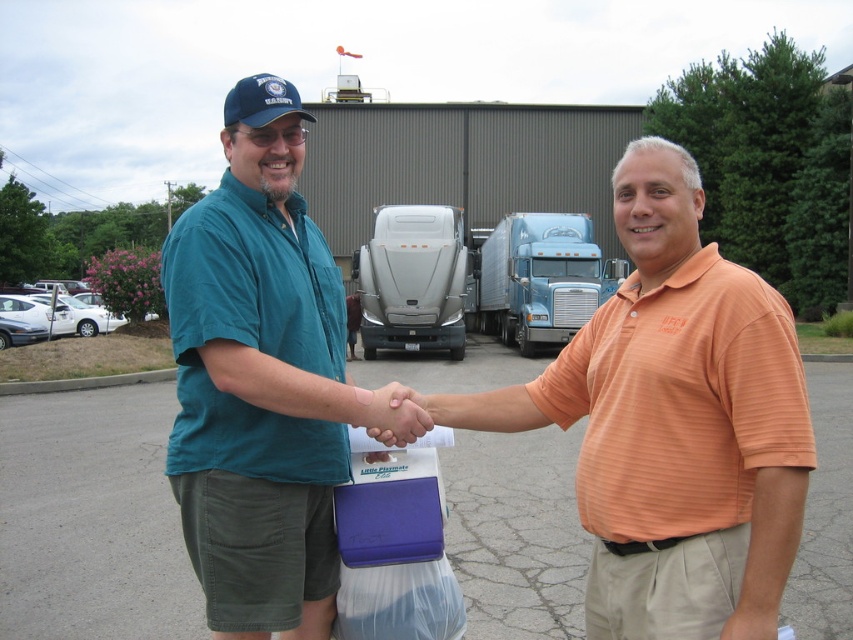
You are a photographer trying to capture a wide shot of the orange striped polo shirt at center and the blue metallic truck at center in the image. If the camera can only focus on objects wider than 1 meter, will both objects be in focus?

The orange striped polo shirt at center has a width less than the blue metallic truck at center, but since the blue metallic truck at center is wider than 1 meter, it will be in focus. However, the orange striped polo shirt at center may not be wide enough to be in focus if its width is under 1 meter.

You are a photographer standing in the parking lot. You need to capture a photo where both the orange striped polo shirt at center and the teal shirt at center are visible. Based on their heights, which person should you position closer to the camera to ensure both are fully visible in the frame?

The orange striped polo shirt at center is shorter than the teal shirt at center. To ensure both are fully visible, position the orange striped polo shirt at center closer to the camera so that their heights align in the frame.